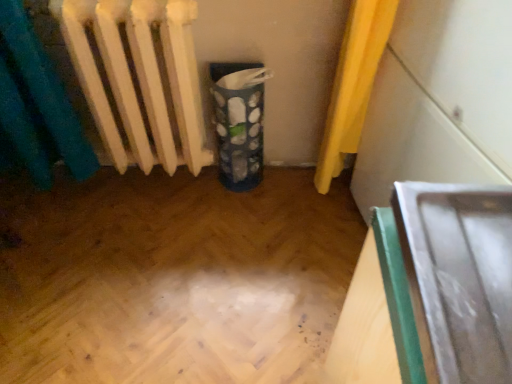
Question: Is white matte radiator at left wider than metallic silver tray at right, which is the 2th wide in left-to-right order?

Choices:
 (A) yes
 (B) no

Answer: (B)

Question: From the image's perspective, would you say white matte radiator at left is shown under metallic silver tray at right, which appears as the 1th wide when viewed from the right?

Choices:
 (A) yes
 (B) no

Answer: (B)

Question: Is white matte radiator at left looking in the opposite direction of metallic silver tray at right, which is the 2th wide in left-to-right order?

Choices:
 (A) yes
 (B) no

Answer: (B)

Question: Is white matte radiator at left to the left of metallic silver tray at right, which appears as the 1th wide when viewed from the right, from the viewer's perspective?

Choices:
 (A) yes
 (B) no

Answer: (A)

Question: Could you tell me if white matte radiator at left is facing metallic silver tray at right, which appears as the 1th wide when viewed from the right?

Choices:
 (A) yes
 (B) no

Answer: (B)

Question: Considering the positions of blue fabric recycling bin at center and metallic silver tray at right, which appears as the 1th wide when viewed from the right, in the image, is blue fabric recycling bin at center wider or thinner than metallic silver tray at right, which appears as the 1th wide when viewed from the right,?

Choices:
 (A) thin
 (B) wide

Answer: (A)

Question: In terms of size, does blue fabric recycling bin at center appear bigger or smaller than metallic silver tray at right, which is the 2th wide in left-to-right order?

Choices:
 (A) small
 (B) big

Answer: (A)

Question: Do you think blue fabric recycling bin at center is within metallic silver tray at right, which appears as the 1th wide when viewed from the right, or outside of it?

Choices:
 (A) outside
 (B) inside

Answer: (A)

Question: Considering the relative positions of blue fabric recycling bin at center and metallic silver tray at right, which appears as the 1th wide when viewed from the right, in the image provided, is blue fabric recycling bin at center to the left or to the right of metallic silver tray at right, which appears as the 1th wide when viewed from the right,?

Choices:
 (A) right
 (B) left

Answer: (B)

Question: Is blue fabric recycling bin at center inside the boundaries of metallic silver tray at lower right, which is the second wide from right to left, or outside?

Choices:
 (A) outside
 (B) inside

Answer: (A)

Question: Looking at the image, does blue fabric recycling bin at center seem bigger or smaller compared to metallic silver tray at lower right, which is the second wide from right to left?

Choices:
 (A) big
 (B) small

Answer: (B)

Question: Considering the relative positions of blue fabric recycling bin at center and metallic silver tray at lower right, which is the first wide from left to right, in the image provided, is blue fabric recycling bin at center to the left or to the right of metallic silver tray at lower right, which is the first wide from left to right,?

Choices:
 (A) right
 (B) left

Answer: (B)

Question: From the image's perspective, is blue fabric recycling bin at center positioned above or below metallic silver tray at lower right, which is the second wide from right to left?

Choices:
 (A) above
 (B) below

Answer: (A)

Question: Is metallic silver tray at lower right, which is the first wide from left to right, taller or shorter than blue fabric recycling bin at center?

Choices:
 (A) tall
 (B) short

Answer: (A)

Question: From the image's perspective, is metallic silver tray at lower right, which is the second wide from right to left, positioned above or below blue fabric recycling bin at center?

Choices:
 (A) below
 (B) above

Answer: (A)